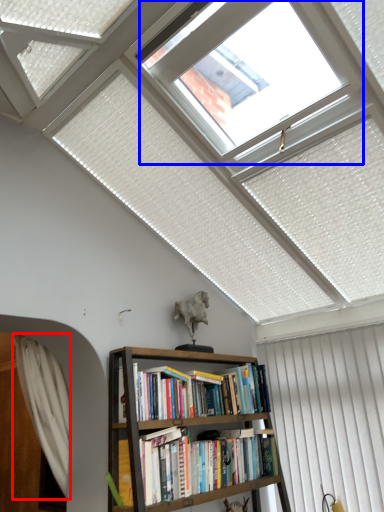
Question: Which of the following is the closest to the observer, curtain (highlighted by a red box) or bay window (highlighted by a blue box)?

Choices:
 (A) curtain
 (B) bay window

Answer: (B)